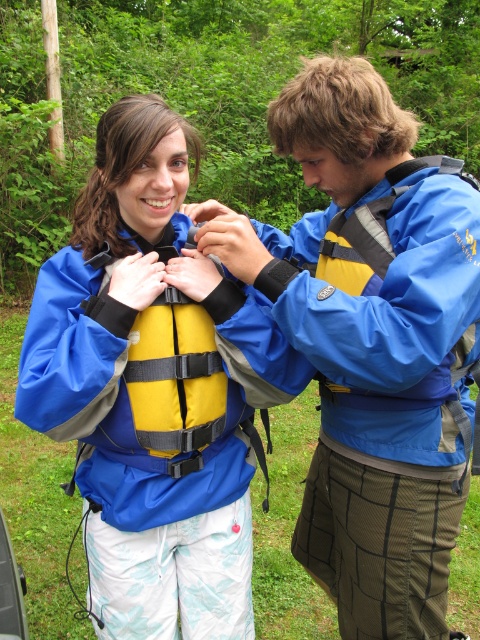
Does blue waterproof jacket at center appear on the left side of matte blue jacket at center?

Incorrect, blue waterproof jacket at center is not on the left side of matte blue jacket at center.

Who is shorter, blue waterproof jacket at center or matte blue jacket at center?

blue waterproof jacket at center is shorter.

Is point (377, 268) closer to viewer compared to point (231, 324)?

No, it is not.

The height and width of the screenshot is (640, 480). In order to click on blue waterproof jacket at center in this screenshot , I will do `click(387, 310)`.